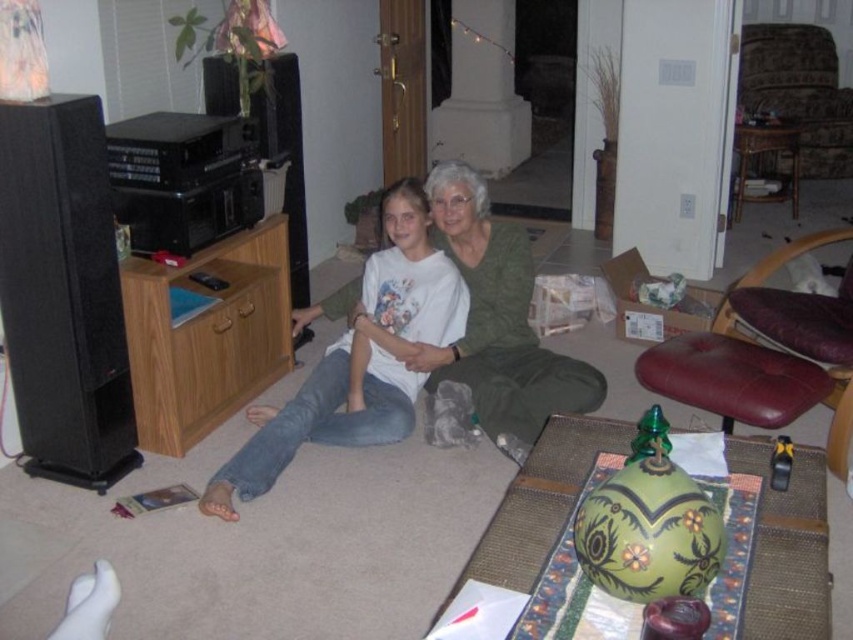
Between white cotton shirt at center and green textured sweater at center, which one appears on the left side from the viewer's perspective?

Positioned to the left is white cotton shirt at center.

Measure the distance between white cotton shirt at center and green textured sweater at center.

white cotton shirt at center is 9.65 inches from green textured sweater at center.

The height and width of the screenshot is (640, 853). Find the location of `white cotton shirt at center`. white cotton shirt at center is located at coordinates (358, 358).

Between white cotton shirt at center and patterned fabric ottoman at upper right, which one is positioned higher?

patterned fabric ottoman at upper right is higher up.

Which is more to the right, white cotton shirt at center or patterned fabric ottoman at upper right?

patterned fabric ottoman at upper right

Which is in front, point (262, 410) or point (833, 172)?

Point (262, 410) is in front.

Locate an element on the screen. The height and width of the screenshot is (640, 853). white cotton shirt at center is located at coordinates (358, 358).

Does green textured sweater at center have a smaller size compared to patterned fabric ottoman at upper right?

Correct, green textured sweater at center occupies less space than patterned fabric ottoman at upper right.

Which of these two, green textured sweater at center or patterned fabric ottoman at upper right, stands shorter?

With less height is green textured sweater at center.

The height and width of the screenshot is (640, 853). Describe the element at coordinates (497, 321) in the screenshot. I see `green textured sweater at center` at that location.

You are a GUI agent. You are given a task and a screenshot of the screen. Output one action in this format:
    pyautogui.click(x=<x>, y=<y>)
    Task: Click on the green textured sweater at center
    The width and height of the screenshot is (853, 640).
    Given the screenshot: What is the action you would take?
    pyautogui.click(x=497, y=321)